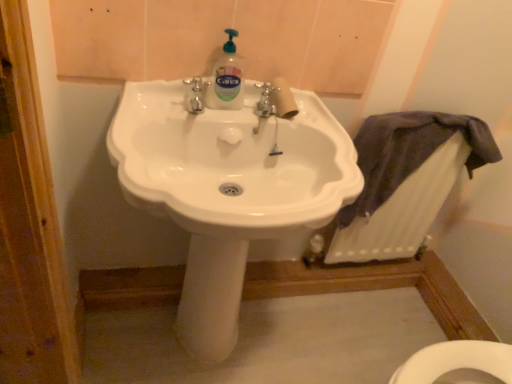
This screenshot has height=384, width=512. I want to click on vacant space to the right of white glossy sink at center, so click(340, 333).